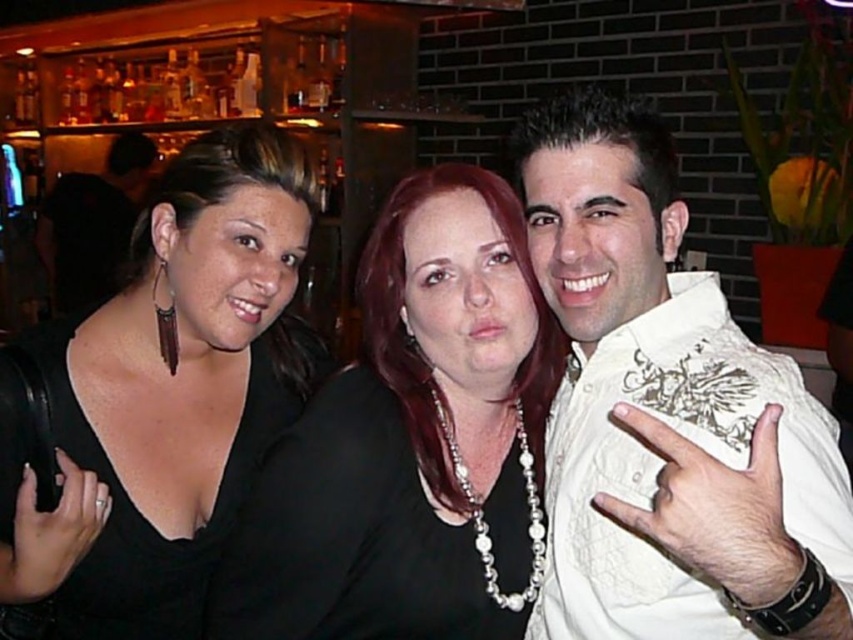
Question: Estimate the real-world distances between objects in this image. Which object is farther from the matte black shirt at left?

Choices:
 (A) black fabric shirt at center
 (B) white textured shirt at right

Answer: (B)

Question: Is black fabric dress at left positioned in front of black fabric shirt at center?

Choices:
 (A) yes
 (B) no

Answer: (A)

Question: Is white textured shirt at right thinner than black fabric shirt at center?

Choices:
 (A) yes
 (B) no

Answer: (A)

Question: Which object is the farthest from the matte black shirt at left?

Choices:
 (A) black fabric dress at left
 (B) white textured shirt at right

Answer: (B)

Question: Estimate the real-world distances between objects in this image. Which object is closer to the white textured shirt at right?

Choices:
 (A) black fabric dress at left
 (B) matte black shirt at left
 (C) black fabric shirt at center

Answer: (C)

Question: Does white textured shirt at right appear under black fabric shirt at center?

Choices:
 (A) no
 (B) yes

Answer: (A)